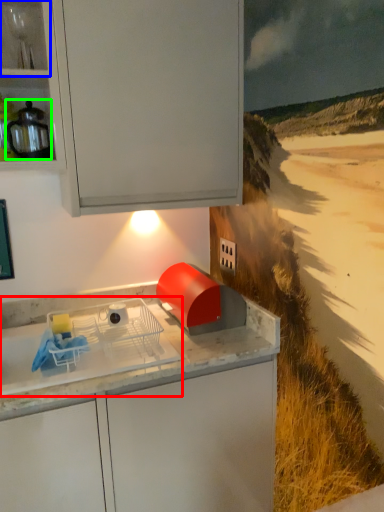
Question: Considering the real-world distances, which object is farthest from home appliance (highlighted by a red box)? shelf (highlighted by a blue box) or kitchen appliance (highlighted by a green box)?

Choices:
 (A) shelf
 (B) kitchen appliance

Answer: (A)